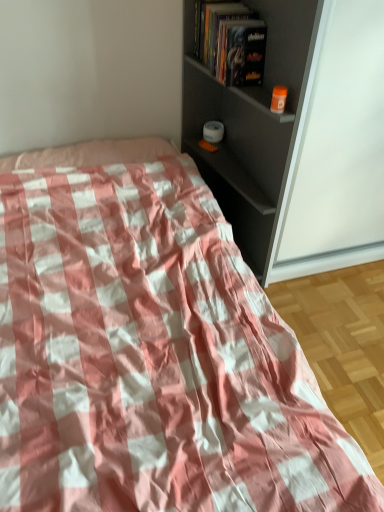
The image size is (384, 512). In order to click on hardcover book at upper center in this screenshot , I will do `click(243, 53)`.

In order to face matte gray shelf at upper right, should I rotate leftwards or rightwards?

It's best to rotate right around 4.573 degrees.

This screenshot has height=512, width=384. In order to click on hardcover book at upper center in this screenshot , I will do `click(243, 53)`.

Could you tell me if hardcover book at upper center is turned towards pink checkered fabric at center?

No, hardcover book at upper center does not turn towards pink checkered fabric at center.

Between hardcover book at upper center and pink checkered fabric at center, which one appears on the left side from the viewer's perspective?

Positioned to the left is pink checkered fabric at center.

Does hardcover book at upper center have a larger size compared to pink checkered fabric at center?

No, hardcover book at upper center is not bigger than pink checkered fabric at center.

Which of these two, hardcover book at upper center or pink checkered fabric at center, stands shorter?

hardcover book at upper center.

Is hardcover book at upper center positioned with its back to matte gray shelf at upper right?

Absolutely, hardcover book at upper center is directed away from matte gray shelf at upper right.

From a real-world perspective, who is located higher, hardcover book at upper center or matte gray shelf at upper right?

hardcover book at upper center.

In the scene shown: Which is closer, [251,67] or [267,103]?

The point [267,103] is closer to the camera.

Can you confirm if hardcover book at upper center is positioned to the left of matte gray shelf at upper right?

In fact, hardcover book at upper center is to the right of matte gray shelf at upper right.

Is point (282, 169) positioned behind point (246, 83)?

That is False.

Is matte gray shelf at upper right behind hardcover book at upper center?

No, it is not.

Is matte gray shelf at upper right taller than hardcover book at upper center?

Yes.

Is pink checkered fabric at center with hardcover book at upper center?

They are not placed beside each other.

Considering the relative sizes of pink checkered fabric at center and hardcover book at upper center in the image provided, is pink checkered fabric at center wider than hardcover book at upper center?

Correct, the width of pink checkered fabric at center exceeds that of hardcover book at upper center.

This screenshot has width=384, height=512. In order to click on bed located in front of the hardcover book at upper center in this screenshot , I will do `click(150, 350)`.

Considering the positions of objects matte gray shelf at upper right and pink checkered fabric at center in the image provided, who is in front, matte gray shelf at upper right or pink checkered fabric at center?

pink checkered fabric at center is in front.

Is matte gray shelf at upper right beside pink checkered fabric at center?

They are not placed beside each other.

Does matte gray shelf at upper right turn towards pink checkered fabric at center?

Yes, matte gray shelf at upper right is oriented towards pink checkered fabric at center.

Is pink checkered fabric at center to the right of matte gray shelf at upper right from the viewer's perspective?

Incorrect, pink checkered fabric at center is not on the right side of matte gray shelf at upper right.

Considering the relative sizes of pink checkered fabric at center and matte gray shelf at upper right in the image provided, is pink checkered fabric at center taller than matte gray shelf at upper right?

Incorrect, the height of pink checkered fabric at center is not larger of that of matte gray shelf at upper right.

Is point (17, 320) farther from viewer compared to point (190, 104)?

No, it is in front of (190, 104).

Who is smaller, pink checkered fabric at center or matte gray shelf at upper right?

matte gray shelf at upper right is smaller.

Locate an element on the screen. bed lying on the left of hardcover book at upper center is located at coordinates (150, 350).

Locate an element on the screen. This screenshot has height=512, width=384. paperback book that is on the right side of matte gray shelf at upper right is located at coordinates (243, 53).

Based on their spatial positions, is pink checkered fabric at center or matte gray shelf at upper right further from hardcover book at upper center?

The object further to hardcover book at upper center is pink checkered fabric at center.

Based on their spatial positions, is hardcover book at upper center or matte gray shelf at upper right closer to pink checkered fabric at center?

matte gray shelf at upper right.

Considering their positions, is hardcover book at upper center positioned closer to matte gray shelf at upper right than pink checkered fabric at center?

hardcover book at upper center is positioned closer to the anchor matte gray shelf at upper right.

Consider the image. Estimate the real-world distances between objects in this image. Which object is closer to matte gray shelf at upper right, pink checkered fabric at center or hardcover book at upper center?

hardcover book at upper center.

When comparing their distances from hardcover book at upper center, does matte gray shelf at upper right or pink checkered fabric at center seem closer?

Based on the image, matte gray shelf at upper right appears to be nearer to hardcover book at upper center.

When comparing their distances from pink checkered fabric at center, does matte gray shelf at upper right or hardcover book at upper center seem further?

hardcover book at upper center is positioned further to the anchor pink checkered fabric at center.

Find the location of a particular element. shelf located between pink checkered fabric at center and hardcover book at upper center in the depth direction is located at coordinates coord(251,124).